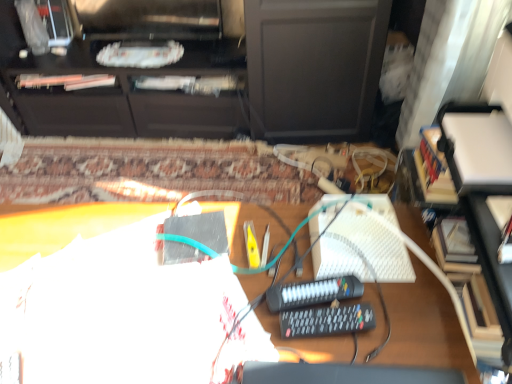
Locate an element on the screen. The width and height of the screenshot is (512, 384). free region on the left part of black plastic remote control at center, which is counted as the 2th equipment, starting from the back is located at coordinates (236, 327).